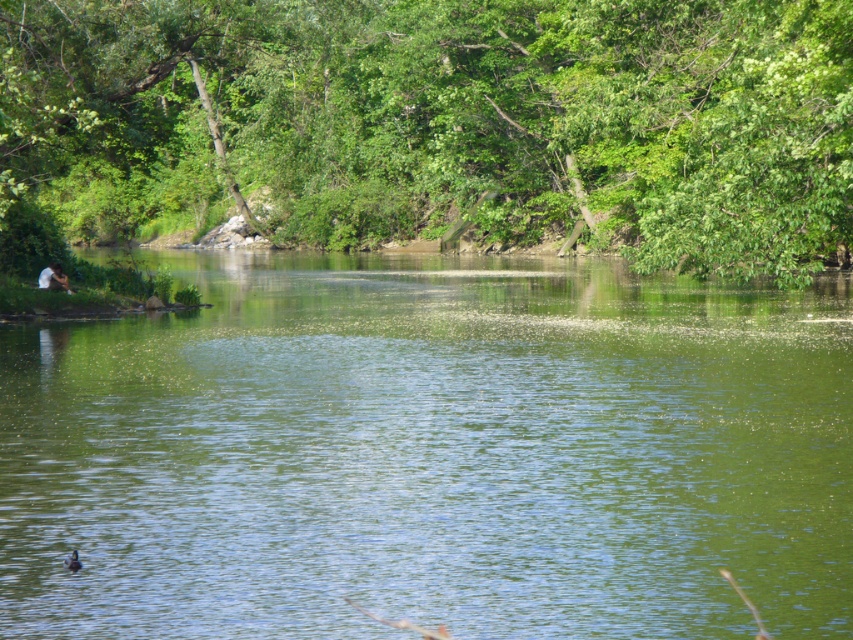
You are standing at the point labeled point (79, 564) and want to walk to the point labeled point (407, 348). Is there a clear path between these two points without any obstacles?

Point (407, 348) is behind point (79, 564), so there might be obstacles blocking the direct path between them. You may need to find an alternative route around the area.

Looking at this image, you are standing at the edge of the water and want to locate the green leafy tree at upper center. According to the coordinates provided, where exactly is it positioned?

The green leafy tree at upper center is located at coordinates point (x=444, y=120).